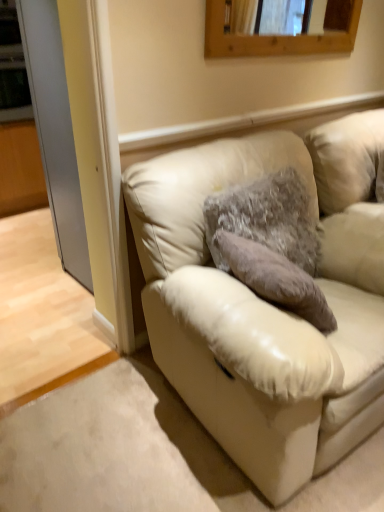
Question: Does wooden frame at upper center have a lesser height compared to fuzzy fabric pillow at center?

Choices:
 (A) no
 (B) yes

Answer: (B)

Question: Can you confirm if wooden frame at upper center is taller than fuzzy fabric pillow at center?

Choices:
 (A) no
 (B) yes

Answer: (A)

Question: Can you confirm if wooden frame at upper center is wider than fuzzy fabric pillow at center?

Choices:
 (A) no
 (B) yes

Answer: (A)

Question: Is wooden frame at upper center located outside fuzzy fabric pillow at center?

Choices:
 (A) yes
 (B) no

Answer: (A)

Question: Considering the relative sizes of wooden frame at upper center and fuzzy fabric pillow at center in the image provided, is wooden frame at upper center bigger than fuzzy fabric pillow at center?

Choices:
 (A) yes
 (B) no

Answer: (B)

Question: Is wooden frame at upper center facing away from fuzzy fabric pillow at center?

Choices:
 (A) no
 (B) yes

Answer: (A)

Question: From a real-world perspective, is wooden frame at upper center positioned over clear glass door at left based on gravity?

Choices:
 (A) yes
 (B) no

Answer: (A)

Question: Is wooden frame at upper center positioned with its back to clear glass door at left?

Choices:
 (A) yes
 (B) no

Answer: (B)

Question: Does wooden frame at upper center come behind clear glass door at left?

Choices:
 (A) no
 (B) yes

Answer: (A)

Question: Is wooden frame at upper center at the left side of clear glass door at left?

Choices:
 (A) no
 (B) yes

Answer: (A)

Question: From the image's perspective, is wooden frame at upper center located beneath clear glass door at left?

Choices:
 (A) yes
 (B) no

Answer: (B)

Question: Is wooden frame at upper center smaller than clear glass door at left?

Choices:
 (A) no
 (B) yes

Answer: (B)

Question: Would you say fuzzy fabric pillow at center is a long distance from beige leather couch at lower right?

Choices:
 (A) no
 (B) yes

Answer: (A)